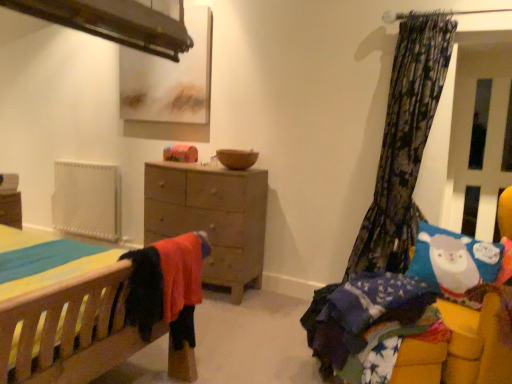
Question: From a real-world perspective, is brown matte bowl at center positioned above or below wooden bed at lower left, marked as the 1th bed in a left-to-right arrangement?

Choices:
 (A) below
 (B) above

Answer: (B)

Question: In the image, is brown matte bowl at center positioned in front of or behind wooden bed at lower left, which is the second bed from right to left?

Choices:
 (A) front
 (B) behind

Answer: (B)

Question: Estimate the real-world distances between objects in this image. Which object is farther from the brown matte bowl at center?

Choices:
 (A) transparent plastic screen door at right
 (B) floral fabric curtain at right
 (C) fluffy blue blanket at lower right, which is the 1th bed in right-to-left order
 (D) matte brown picture frame at upper center
 (E) white textured radiator at left

Answer: (E)

Question: Which object is positioned farthest from the fluffy blue blanket at lower right, placed as the 2th bed when sorted from left to right?

Choices:
 (A) wooden bed at lower left, marked as the 1th bed in a left-to-right arrangement
 (B) transparent plastic screen door at right
 (C) multicolored fabric at lower right
 (D) matte brown picture frame at upper center
 (E) wooden chest of drawers at center

Answer: (D)